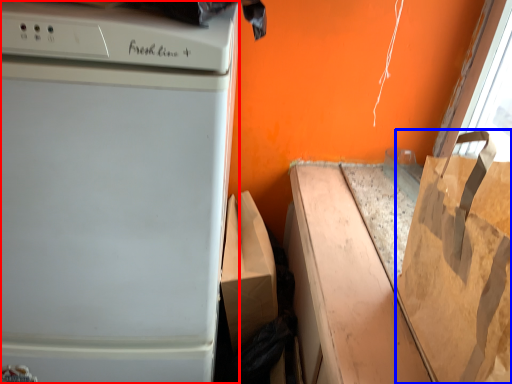
Question: Among these objects, which one is farthest to the camera, home appliance (highlighted by a red box) or grocery bag (highlighted by a blue box)?

Choices:
 (A) home appliance
 (B) grocery bag

Answer: (A)